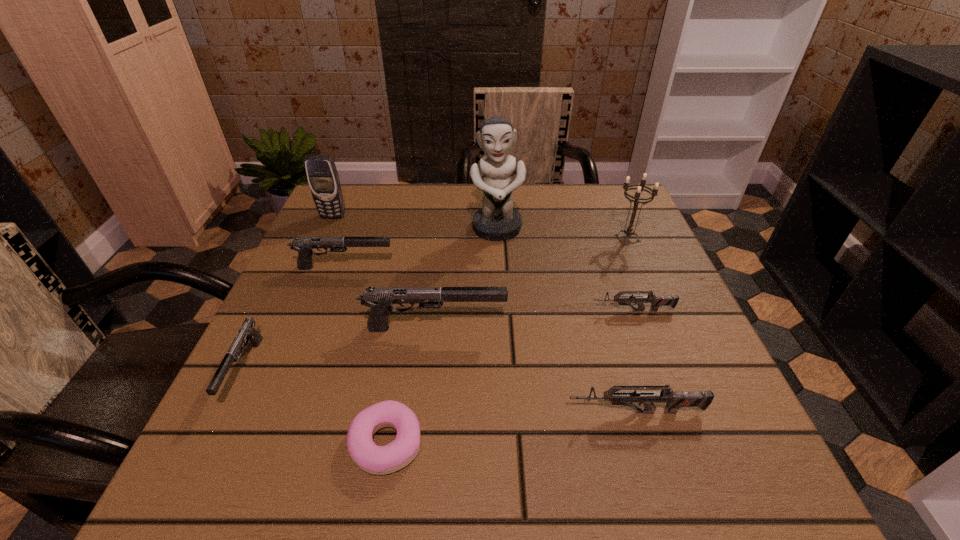
I want to click on blank space located 0.220m aimed along the barrel of the nearer grey gun, so click(x=428, y=412).

This screenshot has width=960, height=540. Identify the location of vacant space located 0.190m aimed along the barrel of the nearer grey gun. (446, 412).

The image size is (960, 540). I want to click on free point located at the muzzle end of the nearest gray gun, so click(x=185, y=489).

Where is `free space located 0.090m aimed along the barrel of the second shortest object`? This screenshot has width=960, height=540. free space located 0.090m aimed along the barrel of the second shortest object is located at coordinates (545, 310).

You are a GUI agent. You are given a task and a screenshot of the screen. Output one action in this format:
    pyautogui.click(x=<x>, y=<y>)
    Task: Click on the free spot located aimed along the barrel of the second shortest object
    The image size is (960, 540).
    Given the screenshot: What is the action you would take?
    pyautogui.click(x=510, y=310)

Where is `free spot located 0.210m aimed along the barrel of the second shortest object`? The height and width of the screenshot is (540, 960). free spot located 0.210m aimed along the barrel of the second shortest object is located at coordinates (485, 310).

Where is `vacant region located 0.260m on the back of the pink pastry`? vacant region located 0.260m on the back of the pink pastry is located at coordinates (411, 297).

This screenshot has height=540, width=960. Find the location of `figurine present at the far edge`. figurine present at the far edge is located at coordinates (497, 220).

Image resolution: width=960 pixels, height=540 pixels. In order to click on cellular telephone situated at the far edge in this screenshot , I will do `click(323, 178)`.

At what (x,y) coordinates should I click in order to perform the action: click on candle holder located in the far edge section of the desktop. Please return your answer as a coordinate pair (x, y). This screenshot has height=540, width=960. Looking at the image, I should click on (629, 230).